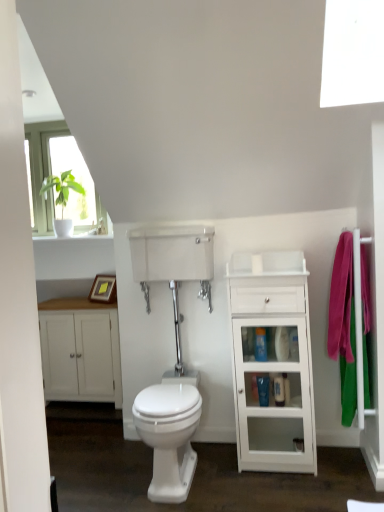
Question: Could blue glossy toiletries at center, the 2th toiletry when ordered from bottom to top, be considered to be inside white matte cabinet at left?

Choices:
 (A) no
 (B) yes

Answer: (A)

Question: Is white matte cabinet at left aimed at blue glossy toiletries at center, the first toiletry in the left-to-right sequence?

Choices:
 (A) no
 (B) yes

Answer: (A)

Question: Is white matte cabinet at left far away from blue glossy toiletries at center, the first toiletry in the left-to-right sequence?

Choices:
 (A) yes
 (B) no

Answer: (A)

Question: Can you confirm if white matte cabinet at left is shorter than blue glossy toiletries at center, the 2th toiletry when ordered from bottom to top?

Choices:
 (A) yes
 (B) no

Answer: (B)

Question: Does white matte cabinet at left lie in front of blue glossy toiletries at center, the first toiletry viewed from the top?

Choices:
 (A) no
 (B) yes

Answer: (A)

Question: Can you confirm if white matte cabinet at left is positioned to the left of blue glossy toiletries at center, the 2th toiletry when ordered from bottom to top?

Choices:
 (A) no
 (B) yes

Answer: (B)

Question: Is blue glossy toiletries at center, the 1th toiletry in the right-to-left sequence, to the left of white matte cabinet at left from the viewer's perspective?

Choices:
 (A) no
 (B) yes

Answer: (A)

Question: Considering the relative sizes of blue glossy toiletries at center, the 1th toiletry in the right-to-left sequence, and white matte cabinet at left in the image provided, is blue glossy toiletries at center, the 1th toiletry in the right-to-left sequence, smaller than white matte cabinet at left?

Choices:
 (A) no
 (B) yes

Answer: (B)

Question: From a real-world perspective, is blue glossy toiletries at center, the 1th toiletry in the right-to-left sequence, positioned under white matte cabinet at left based on gravity?

Choices:
 (A) yes
 (B) no

Answer: (A)

Question: Is blue glossy toiletries at center, which appears as the second toiletry when viewed from the left, closer to camera compared to white matte cabinet at left?

Choices:
 (A) no
 (B) yes

Answer: (B)

Question: Is white matte cabinet at left surrounded by blue glossy toiletries at center, the 2th toiletry viewed from the top?

Choices:
 (A) yes
 (B) no

Answer: (B)

Question: Is blue glossy toiletries at center, the 2th toiletry viewed from the top, wider than white matte cabinet at left?

Choices:
 (A) yes
 (B) no

Answer: (B)

Question: From a real-world perspective, is blue glossy toiletries at center, the first toiletry in the left-to-right sequence, on white glossy bidet at center?

Choices:
 (A) yes
 (B) no

Answer: (A)